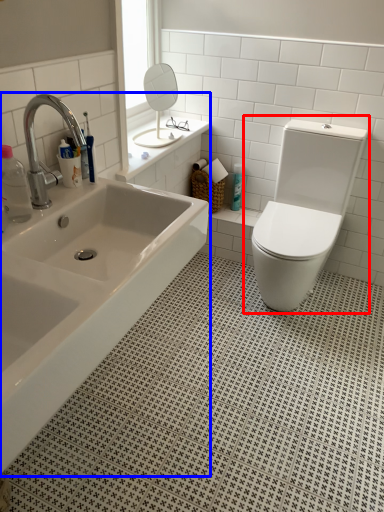
Question: Which point is closer to the camera, toilet (highlighted by a red box) or bathtub (highlighted by a blue box)?

Choices:
 (A) toilet
 (B) bathtub

Answer: (B)